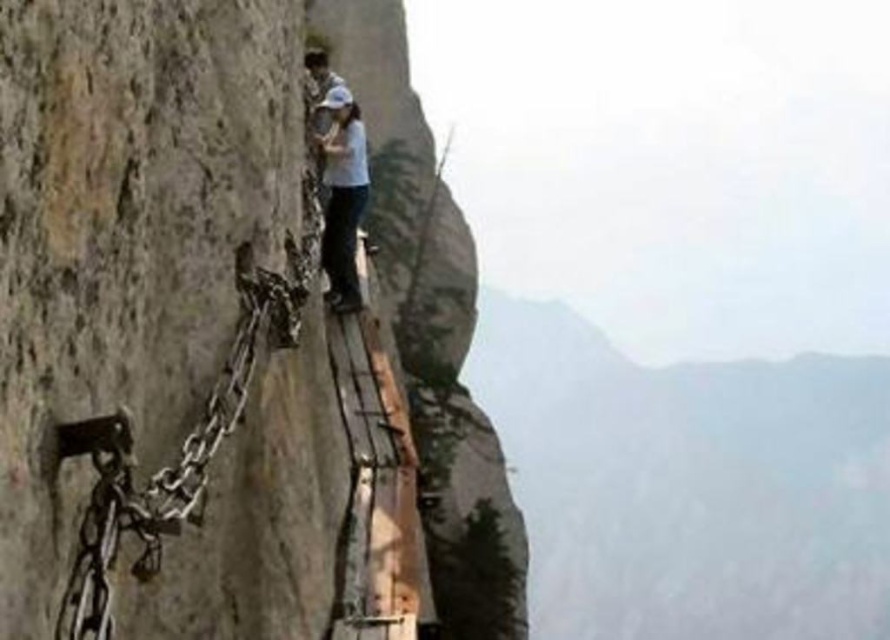
Question: Does rugged stone mountain at upper center have a larger size compared to white matte shirt at center?

Choices:
 (A) no
 (B) yes

Answer: (B)

Question: Which of the following is the closest to the observer?

Choices:
 (A) rugged stone mountain at upper center
 (B) white matte shirt at center

Answer: (B)

Question: Is rugged stone mountain at upper center bigger than white matte shirt at center?

Choices:
 (A) yes
 (B) no

Answer: (A)

Question: Is rugged stone mountain at upper center further to camera compared to white matte shirt at center?

Choices:
 (A) yes
 (B) no

Answer: (A)

Question: Which of the following is the farthest from the observer?

Choices:
 (A) white matte shirt at center
 (B) rugged stone mountain at upper center

Answer: (B)